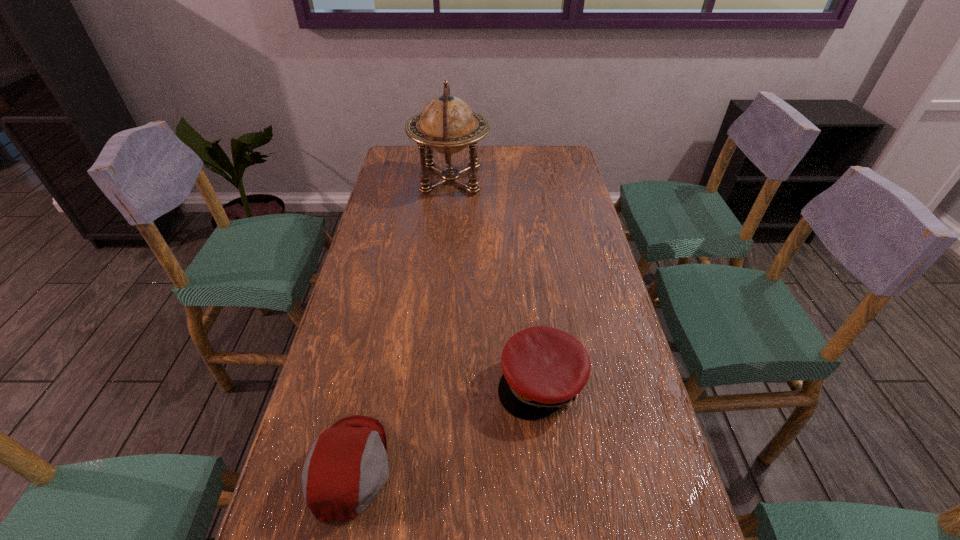
Locate an element on the screen. the tallest object is located at coordinates (447, 124).

This screenshot has width=960, height=540. What are the coordinates of `globe` in the screenshot? It's located at (447, 124).

Locate an element on the screen. The height and width of the screenshot is (540, 960). the left cap is located at coordinates (347, 466).

The image size is (960, 540). What are the coordinates of `the rightmost object` in the screenshot? It's located at (544, 368).

Where is `vacant space positioned on the front-facing side of the farthest object`? vacant space positioned on the front-facing side of the farthest object is located at coordinates (562, 180).

Locate an element on the screen. This screenshot has width=960, height=540. free space located 0.350m on the front-facing side of the left cap is located at coordinates pyautogui.click(x=569, y=467).

Identify the location of vacant space located 0.200m at the front of the rightmost object where the visor is located. (558, 523).

Locate an element on the screen. object that is at the far edge is located at coordinates (447, 124).

Identify the location of globe positioned at the left edge. (447, 124).

Where is `cap at the left edge`? Image resolution: width=960 pixels, height=540 pixels. cap at the left edge is located at coordinates (347, 466).